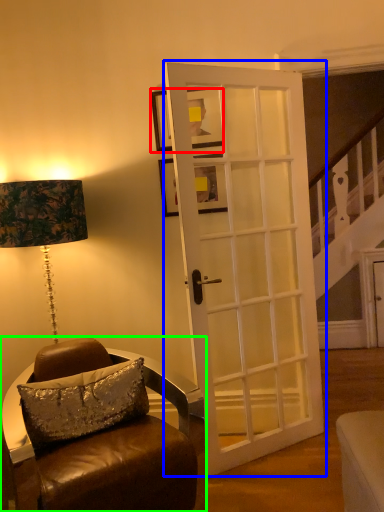
Question: Which object is positioned farthest from picture frame (highlighted by a red box)? Select from door (highlighted by a blue box) and chair (highlighted by a green box).

Choices:
 (A) door
 (B) chair

Answer: (B)